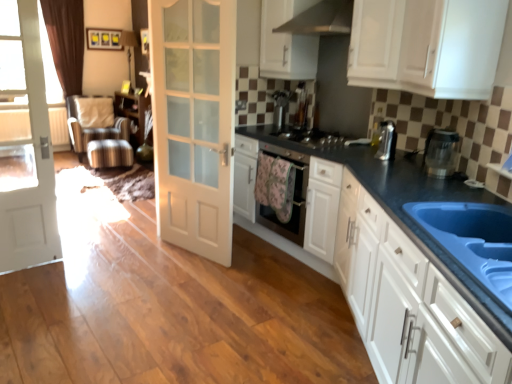
Question: Considering the positions of satin silver ottoman at left and white matte door at center, which is the 1th door in right-to-left order, in the image, is satin silver ottoman at left taller or shorter than white matte door at center, which is the 1th door in right-to-left order,?

Choices:
 (A) short
 (B) tall

Answer: (A)

Question: Does point (88, 140) appear closer or farther from the camera than point (153, 69)?

Choices:
 (A) farther
 (B) closer

Answer: (A)

Question: Based on their relative distances, which object is nearer to the white matte door at center, which is the second door in left-to-right order?

Choices:
 (A) satin black stove at center
 (B) blue composite sink at lower right
 (C) white wood door at left, the 2th door positioned from the right
 (D) stainless steel exhaust hood at upper center
 (E) transparent plastic kettle at right

Answer: (A)

Question: Considering the real-world distances, which object is closest to the satin silver ottoman at left?

Choices:
 (A) white matte door at center, which is the second door in left-to-right order
 (B) white glossy cabinet at upper center, which is the 4th cabinetry in bottom-to-top order
 (C) transparent plastic kettle at right
 (D) white glossy cabinet at upper right, positioned as the second cabinetry in bottom-to-top order
 (E) satin silver coffee machine at upper right, arranged as the 2th coffee machine when viewed from the back

Answer: (A)